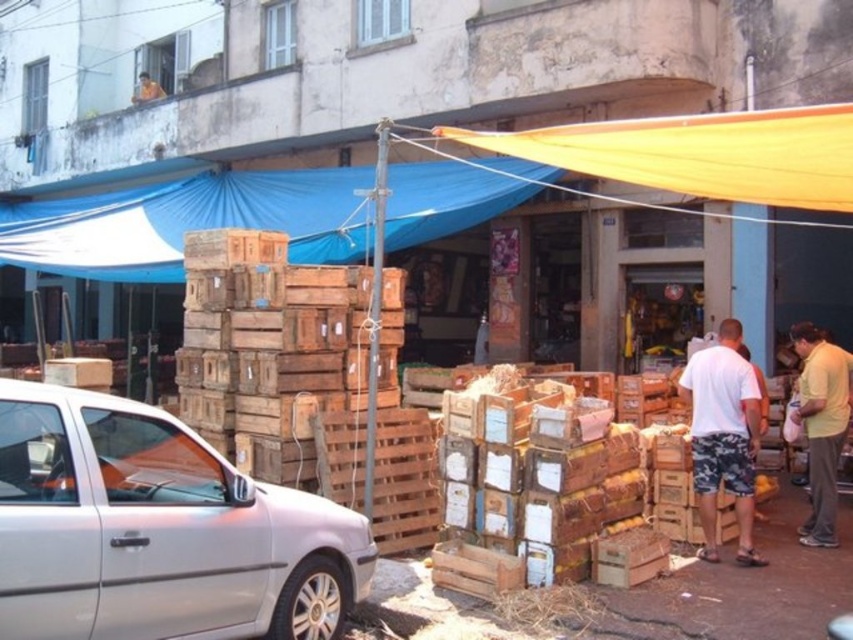
You are a customer at the market and want to find shade. You see the yellow fabric canopy at upper center and the yellow cotton shirt at right. Which one is providing shade over the other?

The yellow fabric canopy at upper center is located above the yellow cotton shirt at right, so it is providing shade over it.

You are standing at the entrance of the market and see the point marked at coordinates (701, 154). What object does this point correspond to in the scene?

The point at coordinates (701, 154) corresponds to the yellow fabric canopy at upper center.